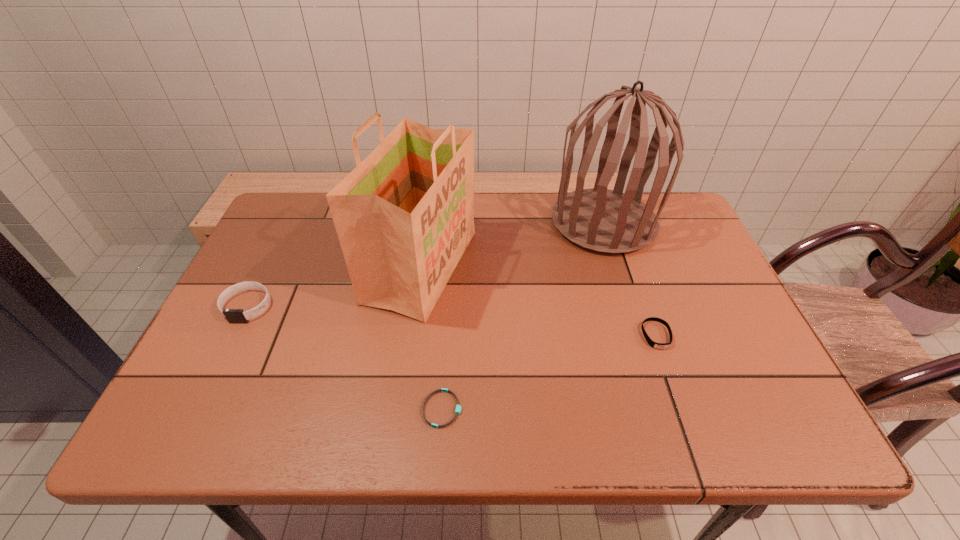
Locate an element on the screen. The height and width of the screenshot is (540, 960). birdcage is located at coordinates (608, 221).

Where is `grocery bag`? Image resolution: width=960 pixels, height=540 pixels. grocery bag is located at coordinates 404,216.

Where is `the leftmost object`? the leftmost object is located at coordinates (232, 315).

You are a GUI agent. You are given a task and a screenshot of the screen. Output one action in this format:
    pyautogui.click(x=<x>, y=<y>)
    Task: Click on the tallest wristband
    
    Given the screenshot: What is the action you would take?
    pyautogui.click(x=232, y=315)

Where is `the second tallest wristband`? the second tallest wristband is located at coordinates (653, 344).

Where is `the rightmost wristband`? The width and height of the screenshot is (960, 540). the rightmost wristband is located at coordinates (653, 344).

Where is `the second wristband from left to right`? The image size is (960, 540). the second wristband from left to right is located at coordinates (458, 407).

Locate an element on the screen. the shortest object is located at coordinates (458, 407).

I want to click on vacant area situated 0.050m on the front of the birdcage, so click(x=619, y=271).

This screenshot has width=960, height=540. I want to click on vacant space located on the front of the grocery bag, so click(409, 355).